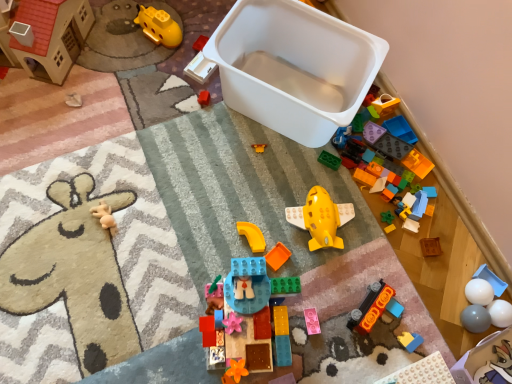
Question: From the image's perspective, is pink matte block at center, the 7th toy from the left, located beneath orange matte car at lower right, marked as the 9th toy in a left-to-right arrangement?

Choices:
 (A) no
 (B) yes

Answer: (B)

Question: Is pink matte block at center, the tenth toy positioned from the right, facing away from orange matte car at lower right, the 8th toy in the right-to-left sequence?

Choices:
 (A) no
 (B) yes

Answer: (A)

Question: Considering the relative sizes of pink matte block at center, the tenth toy positioned from the right, and orange matte car at lower right, the 8th toy in the right-to-left sequence, in the image provided, is pink matte block at center, the tenth toy positioned from the right, shorter than orange matte car at lower right, the 8th toy in the right-to-left sequence,?

Choices:
 (A) no
 (B) yes

Answer: (B)

Question: Does pink matte block at center, the 7th toy from the left, come behind orange matte car at lower right, the 8th toy in the right-to-left sequence?

Choices:
 (A) no
 (B) yes

Answer: (B)

Question: From a real-world perspective, is pink matte block at center, the tenth toy positioned from the right, physically below orange matte car at lower right, marked as the 9th toy in a left-to-right arrangement?

Choices:
 (A) yes
 (B) no

Answer: (A)

Question: From the image's perspective, would you say pink matte block at center, the 7th toy from the left, is positioned over orange matte car at lower right, the 8th toy in the right-to-left sequence?

Choices:
 (A) no
 (B) yes

Answer: (A)

Question: Considering the relative sizes of yellow plastic submarine at upper left, which appears as the third toy when viewed from the left, and orange matte car at lower right, the 8th toy in the right-to-left sequence, in the image provided, is yellow plastic submarine at upper left, which appears as the third toy when viewed from the left, taller than orange matte car at lower right, the 8th toy in the right-to-left sequence,?

Choices:
 (A) no
 (B) yes

Answer: (B)

Question: Considering the relative positions of yellow plastic submarine at upper left, which appears as the third toy when viewed from the left, and orange matte car at lower right, the 8th toy in the right-to-left sequence, in the image provided, is yellow plastic submarine at upper left, which appears as the third toy when viewed from the left, to the right of orange matte car at lower right, the 8th toy in the right-to-left sequence, from the viewer's perspective?

Choices:
 (A) no
 (B) yes

Answer: (A)

Question: Is orange matte car at lower right, the 8th toy in the right-to-left sequence, at the back of yellow plastic submarine at upper left, which ranks as the fourteenth toy in right-to-left order?

Choices:
 (A) no
 (B) yes

Answer: (A)

Question: Is yellow plastic submarine at upper left, which appears as the third toy when viewed from the left, thinner than orange matte car at lower right, the 8th toy in the right-to-left sequence?

Choices:
 (A) yes
 (B) no

Answer: (A)

Question: From the image's perspective, is yellow plastic submarine at upper left, which ranks as the fourteenth toy in right-to-left order, above orange matte car at lower right, the 8th toy in the right-to-left sequence?

Choices:
 (A) yes
 (B) no

Answer: (A)

Question: From a real-world perspective, does yellow plastic submarine at upper left, which ranks as the fourteenth toy in right-to-left order, sit lower than orange matte car at lower right, the 8th toy in the right-to-left sequence?

Choices:
 (A) yes
 (B) no

Answer: (B)

Question: Can you confirm if pearl white plastic plate at lower right, which is counted as the 13th toy, starting from the left, is taller than wooden block at center, which is the third toy from right to left?

Choices:
 (A) yes
 (B) no

Answer: (A)